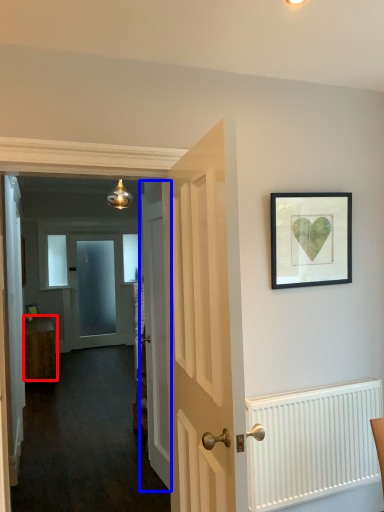
Question: Which of the following is the closest to the observer, furniture (highlighted by a red box) or door (highlighted by a blue box)?

Choices:
 (A) furniture
 (B) door

Answer: (B)